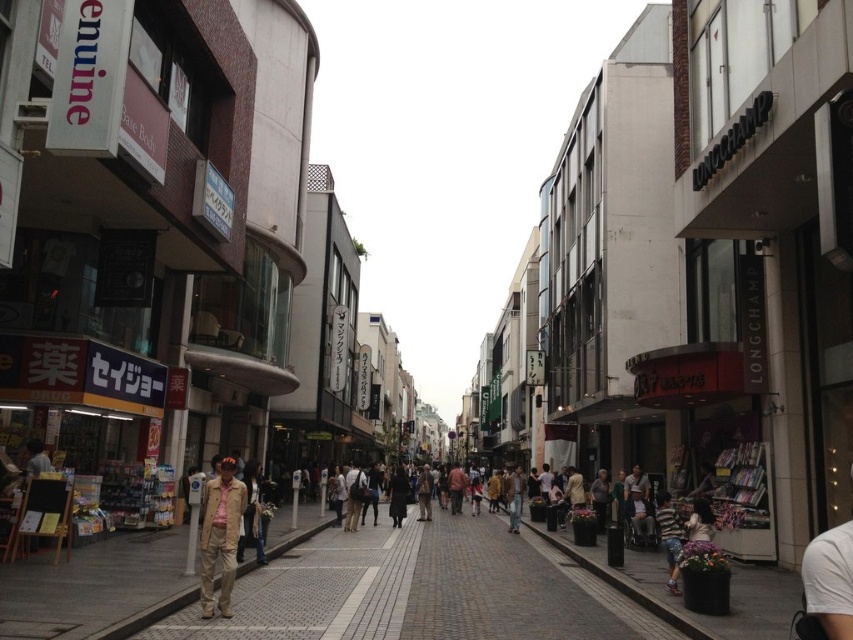
Does brick pavement at center have a greater height compared to tan fabric jacket at lower left?

Indeed, brick pavement at center has a greater height compared to tan fabric jacket at lower left.

Can you confirm if brick pavement at center is positioned to the right of tan fabric jacket at lower left?

Correct, you'll find brick pavement at center to the right of tan fabric jacket at lower left.

The width and height of the screenshot is (853, 640). Find the location of `brick pavement at center`. brick pavement at center is located at coordinates (422, 592).